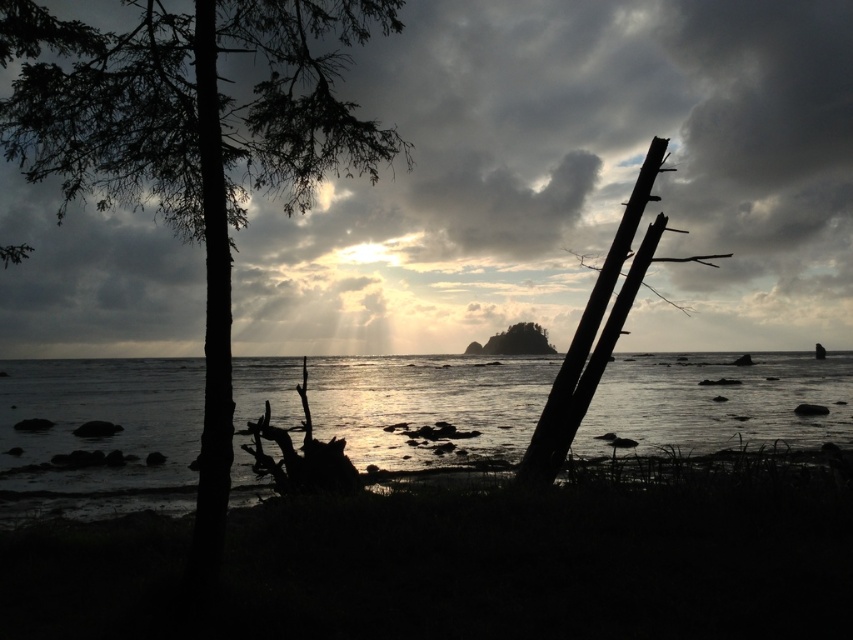
Between silvery reflective water at center and dark green leafy tree at left, which one is positioned lower?

silvery reflective water at center is below.

From the picture: Is silvery reflective water at center thinner than dark green leafy tree at left?

Incorrect, silvery reflective water at center's width is not less than dark green leafy tree at left's.

Which is behind, point (289, 378) or point (370, 141)?

The point (289, 378) is more distant.

The width and height of the screenshot is (853, 640). What are the coordinates of `silvery reflective water at center` in the screenshot? It's located at (100, 436).

Between cloudy textured sky at upper center and smooth brown rock at center, which one has more height?

cloudy textured sky at upper center is taller.

How much distance is there between cloudy textured sky at upper center and smooth brown rock at center?

cloudy textured sky at upper center and smooth brown rock at center are 19.24 meters apart from each other.

Who is more forward, (x=390, y=51) or (x=508, y=340)?

Point (x=390, y=51)

You are a GUI agent. You are given a task and a screenshot of the screen. Output one action in this format:
    pyautogui.click(x=<x>, y=<y>)
    Task: Click on the cloudy textured sky at upper center
    The image size is (853, 640).
    Given the screenshot: What is the action you would take?
    pyautogui.click(x=573, y=179)

In the scene shown: Who is higher up, dark green leafy tree at left or dark brown wood pole at right?

dark green leafy tree at left is above.

Can you confirm if dark green leafy tree at left is positioned to the right of dark brown wood pole at right?

Incorrect, dark green leafy tree at left is not on the right side of dark brown wood pole at right.

What are the coordinates of `dark green leafy tree at left` in the screenshot? It's located at (200, 141).

At what (x,y) coordinates should I click in order to perform the action: click on dark green leafy tree at left. Please return your answer as a coordinate pair (x, y). The width and height of the screenshot is (853, 640). Looking at the image, I should click on (200, 141).